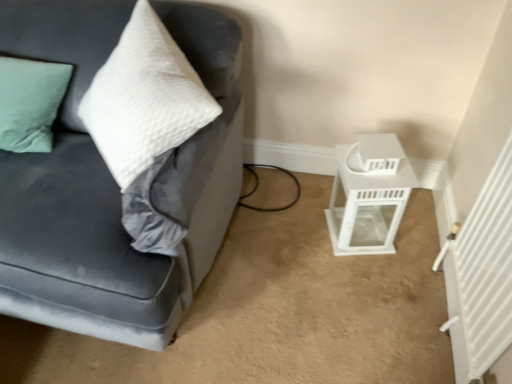
I want to click on free space in front of white glossy lantern at lower right, so click(x=366, y=279).